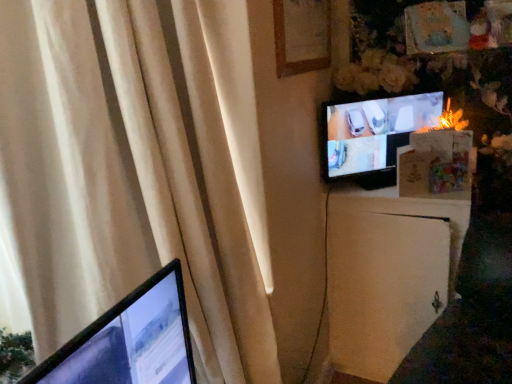
What is the approximate width of matte black tv at upper right?

The width of matte black tv at upper right is 3.56 inches.

The image size is (512, 384). What do you see at coordinates (127, 173) in the screenshot?
I see `beige fabric curtain at left` at bounding box center [127, 173].

Locate an element on the screen. Image resolution: width=512 pixels, height=384 pixels. wooden picture frame at upper center is located at coordinates (301, 36).

Does point (383, 184) come in front of point (56, 209)?

That is False.

In the scene shown: Which is in front, matte black tv at upper right or beige fabric curtain at left?

beige fabric curtain at left.

Consider the image. Is matte black tv at upper right to the left of beige fabric curtain at left from the viewer's perspective?

In fact, matte black tv at upper right is to the right of beige fabric curtain at left.

Identify the location of television that is above the beige fabric curtain at left (from a real-world perspective). The width and height of the screenshot is (512, 384). (373, 136).

From a real-world perspective, which object stands above the other?

From a 3D spatial view, wooden picture frame at upper center is above.

Could wooden picture frame at upper center be considered to be inside white matte file cabinet at right?

No, white matte file cabinet at right does not contain wooden picture frame at upper center.

Considering the relative sizes of white matte file cabinet at right and wooden picture frame at upper center in the image provided, is white matte file cabinet at right bigger than wooden picture frame at upper center?

Yes, white matte file cabinet at right is bigger than wooden picture frame at upper center.

Does white matte file cabinet at right appear on the left side of wooden picture frame at upper center?

In fact, white matte file cabinet at right is to the right of wooden picture frame at upper center.

Considering the relative sizes of matte black tv at upper right and white matte file cabinet at right in the image provided, is matte black tv at upper right bigger than white matte file cabinet at right?

Incorrect, matte black tv at upper right is not larger than white matte file cabinet at right.

Does matte black tv at upper right come behind white matte file cabinet at right?

Yes, matte black tv at upper right is behind white matte file cabinet at right.

Is matte black tv at upper right positioned far away from white matte file cabinet at right?

matte black tv at upper right is near white matte file cabinet at right, not far away.

From the picture: In terms of height, does matte black tv at upper right look taller or shorter compared to white matte file cabinet at right?

Considering their sizes, matte black tv at upper right has less height than white matte file cabinet at right.

Is point (280, 8) positioned behind point (341, 121)?

No.

Is wooden picture frame at upper center facing towards matte black tv at upper right?

No, wooden picture frame at upper center is not aimed at matte black tv at upper right.

Which of these two, wooden picture frame at upper center or matte black tv at upper right, is bigger?

matte black tv at upper right.

The image size is (512, 384). What are the coordinates of `curtain that is in front of the white matte file cabinet at right` in the screenshot? It's located at (127, 173).

Is white matte file cabinet at right closer to camera compared to beige fabric curtain at left?

No, the depth of white matte file cabinet at right is greater than that of beige fabric curtain at left.

In the scene shown: What's the angular difference between white matte file cabinet at right and beige fabric curtain at left's facing directions?

The angular difference between white matte file cabinet at right and beige fabric curtain at left is 44 degrees.

How distant is white matte file cabinet at right from beige fabric curtain at left?

A distance of 33.02 inches exists between white matte file cabinet at right and beige fabric curtain at left.

Are matte black tv at upper right and wooden picture frame at upper center far apart?

No, there isn't a large distance between matte black tv at upper right and wooden picture frame at upper center.

Is matte black tv at upper right looking in the opposite direction of wooden picture frame at upper center?

matte black tv at upper right does not have its back to wooden picture frame at upper center.

From the image's perspective, is matte black tv at upper right positioned above or below wooden picture frame at upper center?

matte black tv at upper right is below wooden picture frame at upper center.

Is beige fabric curtain at left positioned beyond the bounds of white matte file cabinet at right?

Yes, beige fabric curtain at left is located beyond the bounds of white matte file cabinet at right.

Does beige fabric curtain at left touch white matte file cabinet at right?

No, beige fabric curtain at left is not beside white matte file cabinet at right.

Is beige fabric curtain at left looking in the opposite direction of white matte file cabinet at right?

No, beige fabric curtain at left is not facing the opposite direction of white matte file cabinet at right.

The image size is (512, 384). I want to click on television on the right of beige fabric curtain at left, so click(373, 136).

Where is `picture frame in front of the white matte file cabinet at right`? picture frame in front of the white matte file cabinet at right is located at coordinates (301, 36).

Based on their spatial positions, is matte black tv at upper right or wooden picture frame at upper center further from white matte file cabinet at right?

wooden picture frame at upper center.

From the image, which object appears to be nearer to white matte file cabinet at right, beige fabric curtain at left or wooden picture frame at upper center?

beige fabric curtain at left is closer to white matte file cabinet at right.

When comparing their distances from white matte file cabinet at right, does matte black tv at upper right or beige fabric curtain at left seem further?

The object further to white matte file cabinet at right is beige fabric curtain at left.

When comparing their distances from white matte file cabinet at right, does wooden picture frame at upper center or matte black tv at upper right seem closer?

matte black tv at upper right is positioned closer to the anchor white matte file cabinet at right.

Based on their spatial positions, is beige fabric curtain at left or wooden picture frame at upper center closer to matte black tv at upper right?

Among the two, wooden picture frame at upper center is located nearer to matte black tv at upper right.

Which object lies nearer to the anchor point beige fabric curtain at left, white matte file cabinet at right or wooden picture frame at upper center?

Among the two, wooden picture frame at upper center is located nearer to beige fabric curtain at left.

Which object lies further to the anchor point wooden picture frame at upper center, matte black tv at upper right or white matte file cabinet at right?

The object further to wooden picture frame at upper center is white matte file cabinet at right.

In the scene shown: Based on their spatial positions, is matte black tv at upper right or wooden picture frame at upper center closer to beige fabric curtain at left?

Among the two, wooden picture frame at upper center is located nearer to beige fabric curtain at left.

Image resolution: width=512 pixels, height=384 pixels. Identify the location of television between wooden picture frame at upper center and white matte file cabinet at right in the vertical direction. (373, 136).

At what (x,y) coordinates should I click in order to perform the action: click on television between beige fabric curtain at left and white matte file cabinet at right. Please return your answer as a coordinate pair (x, y). Image resolution: width=512 pixels, height=384 pixels. Looking at the image, I should click on (373, 136).

Locate an element on the screen. Image resolution: width=512 pixels, height=384 pixels. picture frame positioned between beige fabric curtain at left and matte black tv at upper right from near to far is located at coordinates (301, 36).

Identify the location of curtain between wooden picture frame at upper center and white matte file cabinet at right in the vertical direction. (127, 173).